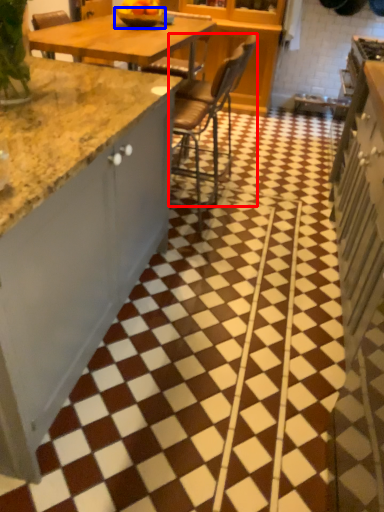
Question: Among these objects, which one is farthest to the camera, chair (highlighted by a red box) or bowl (highlighted by a blue box)?

Choices:
 (A) chair
 (B) bowl

Answer: (B)